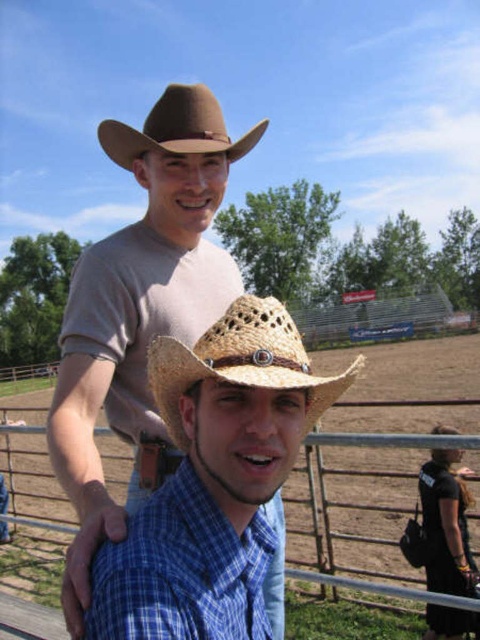
You are standing at the point labeled point (172, 100) and want to move to the point labeled point (433, 456). Given that the rodeo arena is fenced, will you be able to walk directly to your destination without crossing any fences?

Point (433, 456) is behind point (172, 100), so you will have to walk around the fence to reach it.

You are standing in the rodeo arena and see a point at coordinates (139, 312). What object is located at that point?

The point at coordinates (139, 312) corresponds to the matte brown cowboy hat at upper center.

You are standing at the point marked by coordinates point (189, 570) in the image. Which object is directly in front of you?

The point (189, 570) marks the blue plaid shirt at center, so the blue plaid shirt at center is directly in front of you.